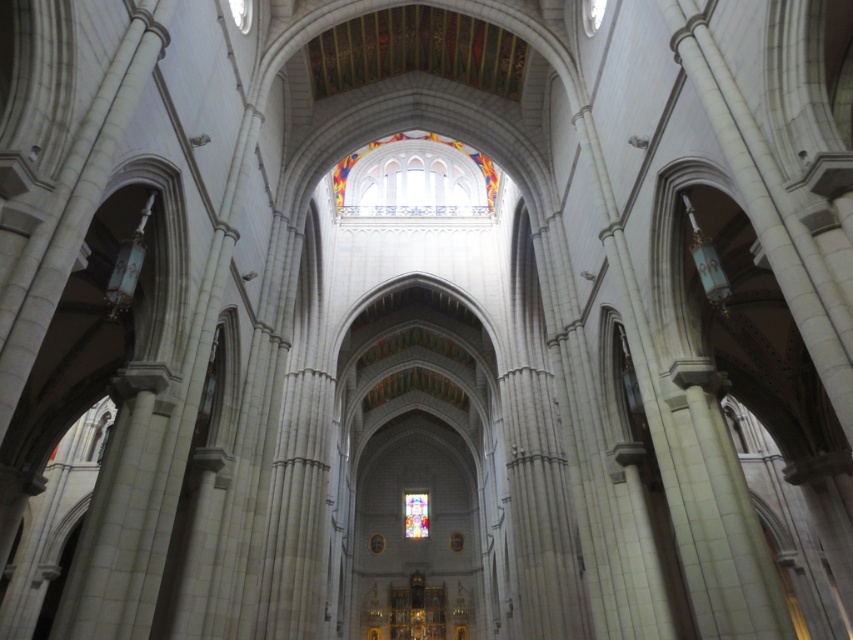
You are an architect examining the cathedral. You notice the stained glass window at center and the translucent stained glass at center. Which one is positioned higher in the cathedral?

The stained glass window at center is positioned higher than the translucent stained glass at center.

You are an architect designing a new cathedral and want to incorporate elements from this image. If you plan to include both the stained glass window at center and the translucent stained glass at center, what is the minimum distance you should maintain between them to match the design proportions shown?

The minimum distance you should maintain between the stained glass window at center and the translucent stained glass at center is 112.47 meters to match the design proportions shown.